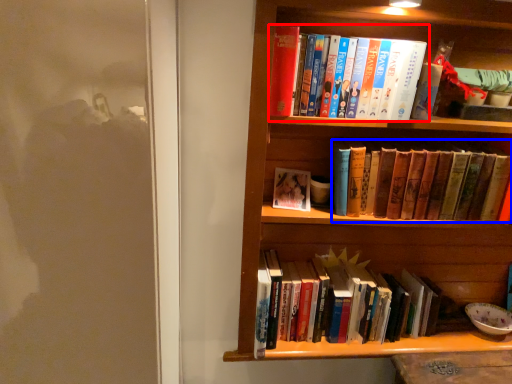
Question: Which of the following is the closest to the observer, book (highlighted by a red box) or book (highlighted by a blue box)?

Choices:
 (A) book
 (B) book

Answer: (A)